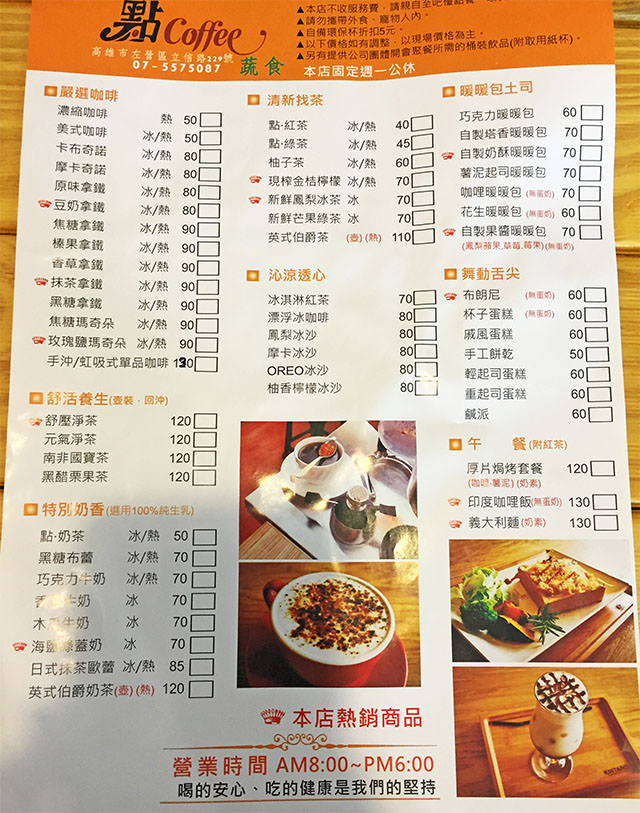
Identify the location of mug. The width and height of the screenshot is (640, 813). (272, 588), (314, 674), (329, 471).